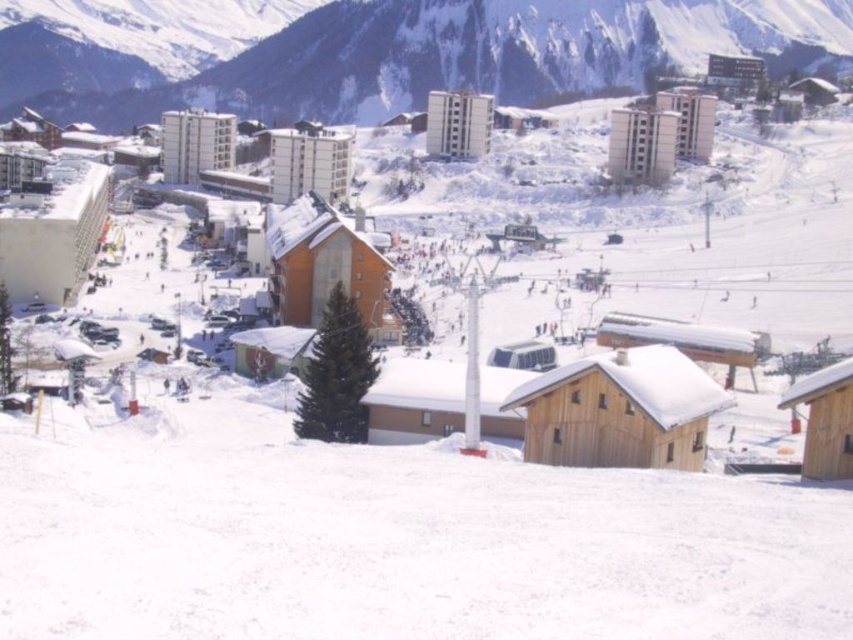
Between white snow at lower center and snowy mountain at upper center, which one has less height?

With less height is white snow at lower center.

Can you confirm if white snow at lower center is thinner than snowy mountain at upper center?

Indeed, white snow at lower center has a lesser width compared to snowy mountain at upper center.

This screenshot has width=853, height=640. What do you see at coordinates (402, 545) in the screenshot?
I see `white snow at lower center` at bounding box center [402, 545].

You are a GUI agent. You are given a task and a screenshot of the screen. Output one action in this format:
    pyautogui.click(x=<x>, y=<y>)
    Task: Click on the white snow at lower center
    
    Given the screenshot: What is the action you would take?
    pyautogui.click(x=402, y=545)